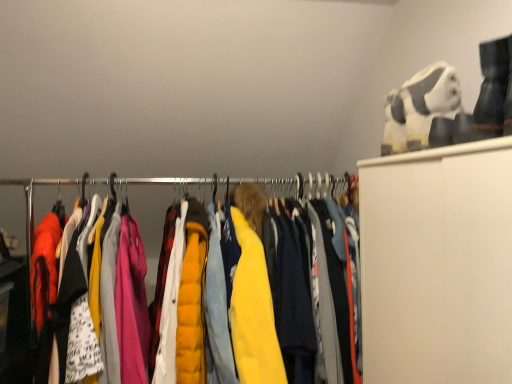
What do you see at coordinates (308, 187) in the screenshot?
I see `yellow quilted jacket at center` at bounding box center [308, 187].

Find the location of a particular element. The width and height of the screenshot is (512, 384). metallic hangers at center is located at coordinates (225, 183).

Is point (204, 185) more distant than point (274, 202)?

No, (204, 185) is closer to viewer.

Between metallic hangers at center and yellow quilted jacket at center, which one has smaller width?

Thinner between the two is metallic hangers at center.

Which object is further away from the camera taking this photo, metallic hangers at center or yellow quilted jacket at center?

metallic hangers at center is further from the camera.

Identify the location of closet below the white plush toy at upper right (from the image's perspective). (308, 187).

From the image's perspective, is yellow quilted jacket at center below white plush toy at upper right?

Yes, from the image's perspective, yellow quilted jacket at center is below white plush toy at upper right.

Is yellow quilted jacket at center bigger or smaller than white plush toy at upper right?

In the image, yellow quilted jacket at center appears to be larger than white plush toy at upper right.

From a real-world perspective, is yellow quilted jacket at center physically above white plush toy at upper right?

No, from a real-world perspective, yellow quilted jacket at center is not over white plush toy at upper right

In terms of size, does white plush toy at upper right appear bigger or smaller than yellow quilted jacket at center?

Considering their sizes, white plush toy at upper right takes up less space than yellow quilted jacket at center.

Relative to yellow quilted jacket at center, is white plush toy at upper right in front or behind?

Clearly, white plush toy at upper right is behind yellow quilted jacket at center.

Is point (436, 100) less distant than point (184, 186)?

Yes, it is.

Is white plush toy at upper right surrounding yellow quilted jacket at center?

No, yellow quilted jacket at center is not inside white plush toy at upper right.

Is yellow quilted jacket at center taller or shorter than metallic hangers at center?

yellow quilted jacket at center is taller than metallic hangers at center.

Where is `closet on the right side of metallic hangers at center`? The width and height of the screenshot is (512, 384). closet on the right side of metallic hangers at center is located at coordinates (308, 187).

Based on the photo, is the surface of yellow quilted jacket at center in direct contact with metallic hangers at center?

Yes, the surface of yellow quilted jacket at center is in contact with metallic hangers at center.

Can you confirm if yellow quilted jacket at center is bigger than metallic hangers at center?

Correct, yellow quilted jacket at center is larger in size than metallic hangers at center.

Is metallic hangers at center looking in the opposite direction of white plush toy at upper right?

No, metallic hangers at center's orientation is not away from white plush toy at upper right.

Considering the positions of objects metallic hangers at center and white plush toy at upper right in the image provided, who is more to the right, metallic hangers at center or white plush toy at upper right?

Positioned to the right is white plush toy at upper right.

Is metallic hangers at center surrounding white plush toy at upper right?

No, white plush toy at upper right is not inside metallic hangers at center.

Can you confirm if white plush toy at upper right is taller than metallic hangers at center?

Yes.

Could you tell me if white plush toy at upper right is facing metallic hangers at center?

No, white plush toy at upper right is not facing towards metallic hangers at center.

From a real-world perspective, is white plush toy at upper right under metallic hangers at center?

No, from a real-world perspective, white plush toy at upper right is not under metallic hangers at center.

How many degrees apart are the facing directions of white plush toy at upper right and metallic hangers at center?

The angle between the facing direction of white plush toy at upper right and the facing direction of metallic hangers at center is 90.1 degrees.

Where is `clothesline above the yellow quilted jacket at center (from a real-world perspective)`? This screenshot has width=512, height=384. clothesline above the yellow quilted jacket at center (from a real-world perspective) is located at coordinates (225, 183).

This screenshot has height=384, width=512. Identify the location of closet in front of the white plush toy at upper right. (308, 187).

Looking at the image, which one is located further to yellow quilted jacket at center, metallic hangers at center or white plush toy at upper right?

Among the two, white plush toy at upper right is located further to yellow quilted jacket at center.

Based on their spatial positions, is yellow quilted jacket at center or white plush toy at upper right further from metallic hangers at center?

Based on the image, white plush toy at upper right appears to be further to metallic hangers at center.

From the picture: From the image, which object appears to be nearer to white plush toy at upper right, yellow quilted jacket at center or metallic hangers at center?

Based on the image, metallic hangers at center appears to be nearer to white plush toy at upper right.

Considering their positions, is white plush toy at upper right positioned further to yellow quilted jacket at center than metallic hangers at center?

white plush toy at upper right.

From the image, which object appears to be nearer to white plush toy at upper right, metallic hangers at center or yellow quilted jacket at center?

Among the two, metallic hangers at center is located nearer to white plush toy at upper right.

Considering their positions, is white plush toy at upper right positioned closer to metallic hangers at center than yellow quilted jacket at center?

yellow quilted jacket at center lies closer to metallic hangers at center than the other object.

The width and height of the screenshot is (512, 384). Identify the location of closet between metallic hangers at center and white plush toy at upper right. (308, 187).